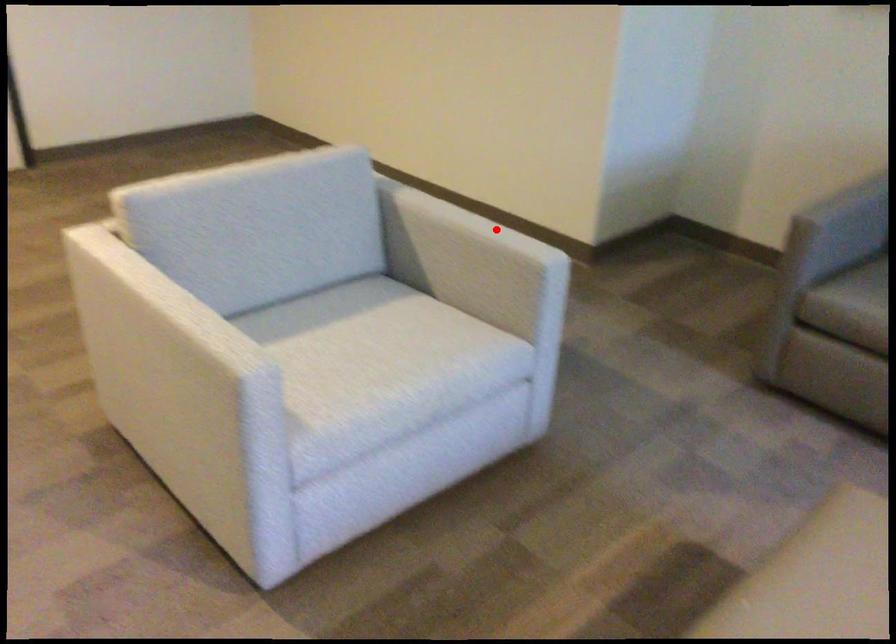
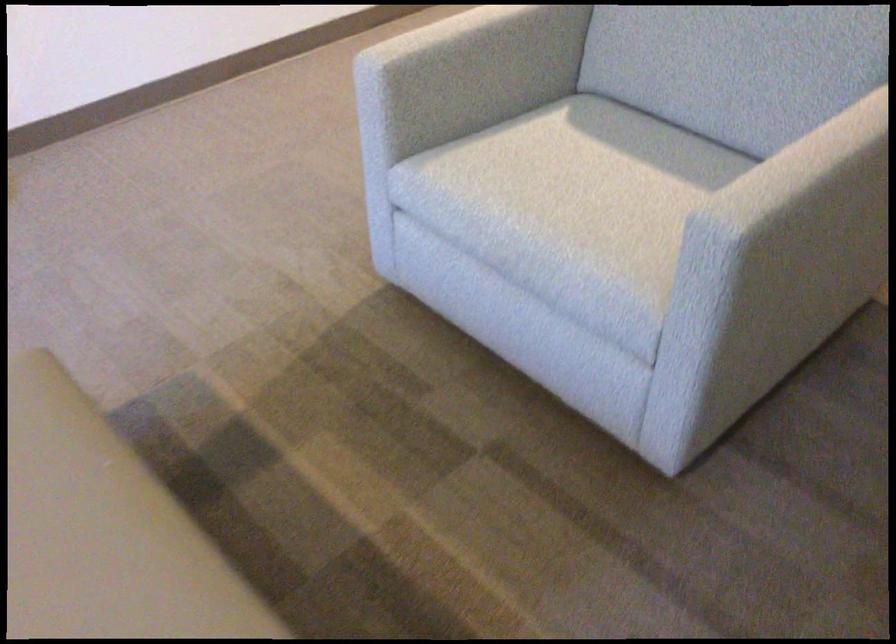
The point at the highlighted location is marked in the first image. Where is the corresponding point in the second image?

(780, 178)